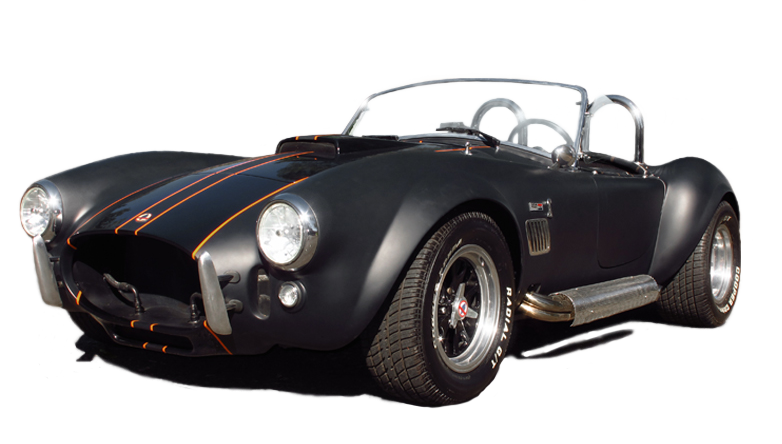
Where is `left mirror`? The height and width of the screenshot is (444, 782). left mirror is located at coordinates (555, 155).